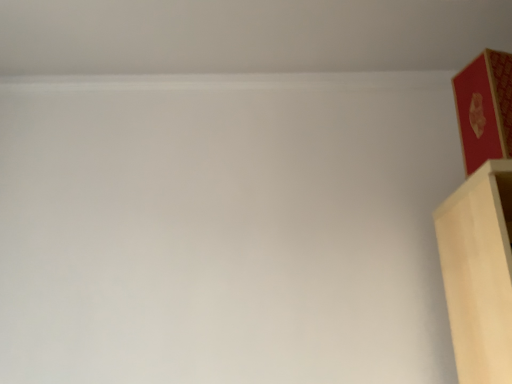
The image size is (512, 384). I want to click on red cardboard box at upper right, so click(x=485, y=108).

Image resolution: width=512 pixels, height=384 pixels. What do you see at coordinates (485, 108) in the screenshot? I see `red cardboard box at upper right` at bounding box center [485, 108].

Locate an element on the screen. The width and height of the screenshot is (512, 384). red cardboard box at upper right is located at coordinates (485, 108).